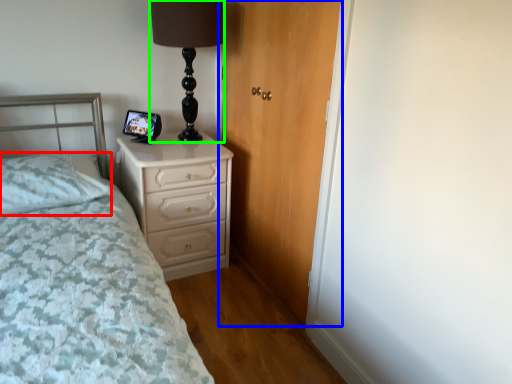
Question: Considering the real-world distances, which object is farthest from pillow (highlighted by a red box)? door (highlighted by a blue box) or table lamp (highlighted by a green box)?

Choices:
 (A) door
 (B) table lamp

Answer: (A)